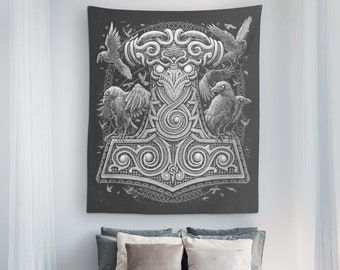
At what (x,y) coordinates should I click in order to perform the action: click on wall. Please return your answer as a coordinate pair (x, y). The width and height of the screenshot is (340, 270). Looking at the image, I should click on (297, 183).